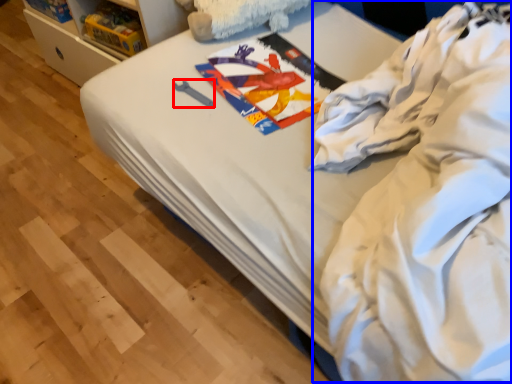
Question: Which of the following is the farthest to the observer, equipment (highlighted by a red box) or clothing (highlighted by a blue box)?

Choices:
 (A) equipment
 (B) clothing

Answer: (A)